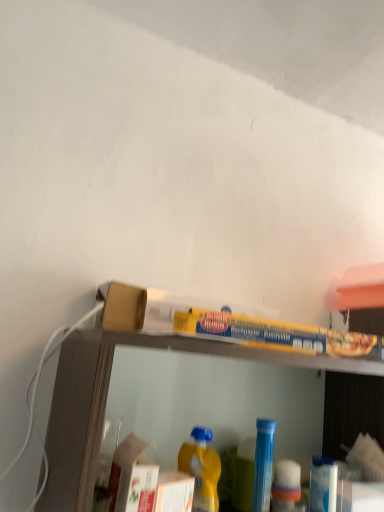
Question: Is yellow matte plastic bottle at lower center, marked as the 1th bottle in a left-to-right arrangement, at the back of clear plastic shelf at upper center?

Choices:
 (A) no
 (B) yes

Answer: (B)

Question: Could you tell me if clear plastic shelf at upper center is facing yellow matte plastic bottle at lower center, the 2th bottle from the right?

Choices:
 (A) yes
 (B) no

Answer: (A)

Question: Can you confirm if clear plastic shelf at upper center is taller than yellow matte plastic bottle at lower center, marked as the 1th bottle in a left-to-right arrangement?

Choices:
 (A) yes
 (B) no

Answer: (A)

Question: Is clear plastic shelf at upper center closer to the viewer compared to yellow matte plastic bottle at lower center, which is the 2th bottle from back to front?

Choices:
 (A) yes
 (B) no

Answer: (A)

Question: Considering the relative sizes of clear plastic shelf at upper center and yellow matte plastic bottle at lower center, the 2th bottle from the right, in the image provided, is clear plastic shelf at upper center bigger than yellow matte plastic bottle at lower center, the 2th bottle from the right,?

Choices:
 (A) yes
 (B) no

Answer: (A)

Question: From a real-world perspective, is clear plastic shelf at upper center above or below yellow matte plastic bottle at lower center, which is the 1th bottle in front-to-back order?

Choices:
 (A) below
 (B) above

Answer: (B)

Question: Is point (107, 377) positioned closer to the camera than point (215, 508)?

Choices:
 (A) farther
 (B) closer

Answer: (B)

Question: Visually, is clear plastic shelf at upper center positioned to the left or to the right of yellow matte plastic bottle at lower center, which is the 1th bottle in front-to-back order?

Choices:
 (A) right
 (B) left

Answer: (A)

Question: Considering the positions of clear plastic shelf at upper center and yellow matte plastic bottle at lower center, which is the 2th bottle from back to front, in the image, is clear plastic shelf at upper center taller or shorter than yellow matte plastic bottle at lower center, which is the 2th bottle from back to front,?

Choices:
 (A) tall
 (B) short

Answer: (A)

Question: Does point (256, 444) appear closer or farther from the camera than point (210, 501)?

Choices:
 (A) closer
 (B) farther

Answer: (B)

Question: Based on their sizes in the image, would you say blue plastic bottle at center, acting as the second bottle starting from the left, is bigger or smaller than yellow matte plastic bottle at lower center, which is the 1th bottle in front-to-back order?

Choices:
 (A) small
 (B) big

Answer: (B)

Question: Is blue plastic bottle at center, acting as the second bottle starting from the left, taller or shorter than yellow matte plastic bottle at lower center, marked as the 1th bottle in a left-to-right arrangement?

Choices:
 (A) short
 (B) tall

Answer: (A)

Question: From the image's perspective, is blue plastic bottle at center, the 1th bottle from the back, positioned above or below yellow matte plastic bottle at lower center, which is the 2th bottle from back to front?

Choices:
 (A) above
 (B) below

Answer: (B)

Question: From their relative heights in the image, would you say yellow matte plastic bottle at lower center, which is the 2th bottle from back to front, is taller or shorter than clear plastic shelf at upper center?

Choices:
 (A) short
 (B) tall

Answer: (A)

Question: In terms of width, does yellow matte plastic bottle at lower center, which is the 1th bottle in front-to-back order, look wider or thinner when compared to clear plastic shelf at upper center?

Choices:
 (A) thin
 (B) wide

Answer: (A)